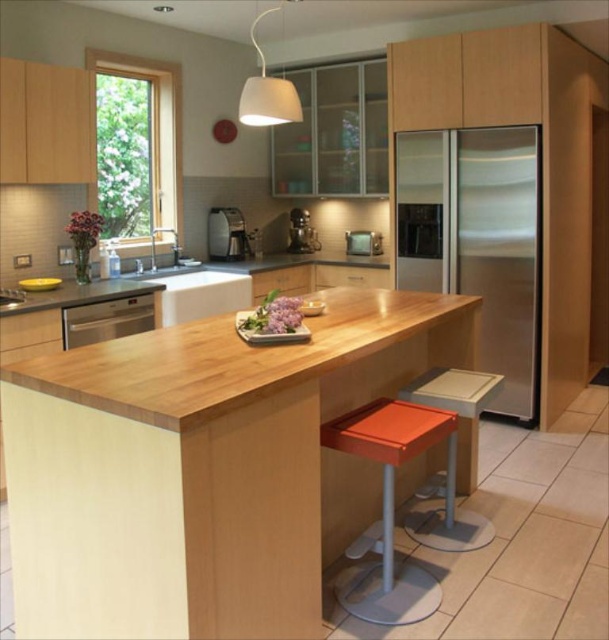
Question: Is stainless steel refrigerator at right thinner than orange matte bar stool at lower center?

Choices:
 (A) no
 (B) yes

Answer: (A)

Question: Which of the following is the closest to the observer?

Choices:
 (A) satin stainless steel dishwasher at left
 (B) orange plastic stool at lower center
 (C) wooden at center
 (D) metallic stainless steel toaster at center

Answer: (C)

Question: Is stainless steel refrigerator at right positioned at the back of satin silver microwave at center?

Choices:
 (A) no
 (B) yes

Answer: (A)

Question: Which point is closer to the camera taking this photo?

Choices:
 (A) (435, 429)
 (B) (364, 474)
 (C) (300, 221)
 (D) (395, 214)

Answer: (A)

Question: Which point is closer to the camera?

Choices:
 (A) (375, 576)
 (B) (367, 240)

Answer: (A)

Question: From the image, what is the correct spatial relationship of orange matte bar stool at lower center in relation to metallic stainless steel toaster at center?

Choices:
 (A) above
 (B) below

Answer: (B)